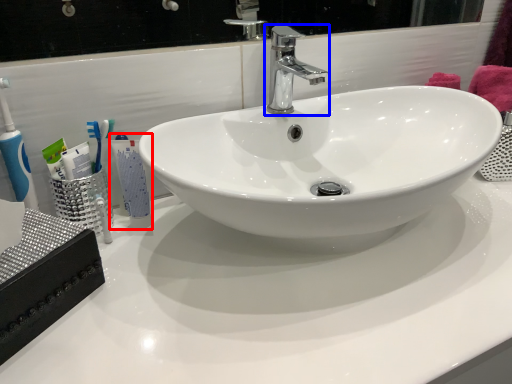
Question: Which point is further to the camera, mouthwash (highlighted by a red box) or tap (highlighted by a blue box)?

Choices:
 (A) mouthwash
 (B) tap

Answer: (A)